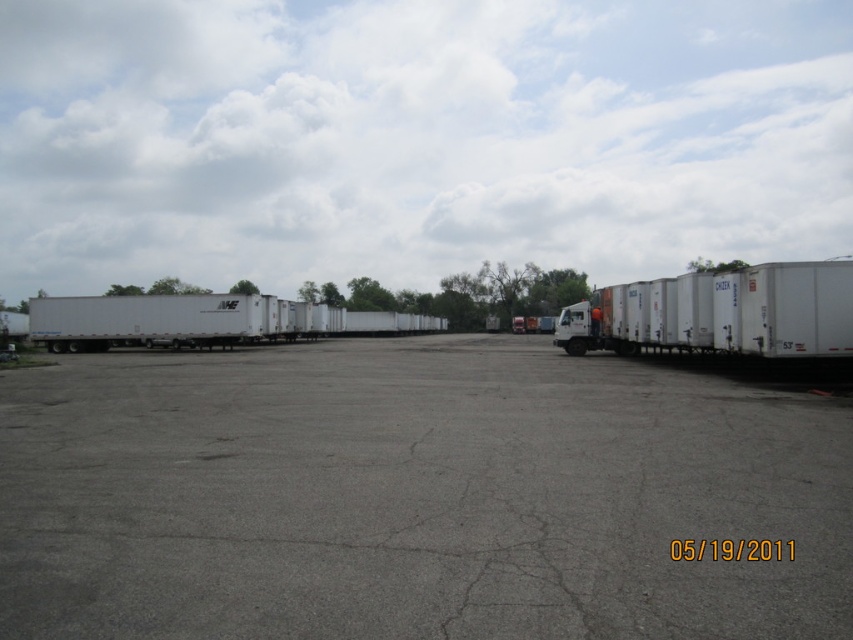
You are a delivery driver who needs to park a new trailer truck in the parking lot. The new trailer truck is the same size as the white matte trailer truck at right. Can it fit in the space currently occupied by the white matte trailer at left?

The white matte trailer truck at right is narrower than the white matte trailer at left. Since the new trailer truck is the same size as the white matte trailer truck at right, it would fit in the space currently occupied by the white matte trailer at left because the space is wider than the new trailer truck.

You are standing at the entrance of the parking lot and want to locate two points marked in the image. The first point is at coordinates point (549, 422) and the second is at point (776, 323). Which point is closer to you when viewed from your current position?

Point (549, 422) is in front of point (776, 323), so it is closer to you.

You are a delivery driver who just arrived at the parking lot. You need to exit your vehicle, the white matte trailer truck at right, and walk to the white matte trailer at left to unload goods. Which direction should you walk to reach the trailer without going around the other parked vehicles?

Since the white matte trailer truck at right is in front of the white matte trailer at left, you can walk directly towards the white matte trailer at left from your current position without needing to go around other vehicles.